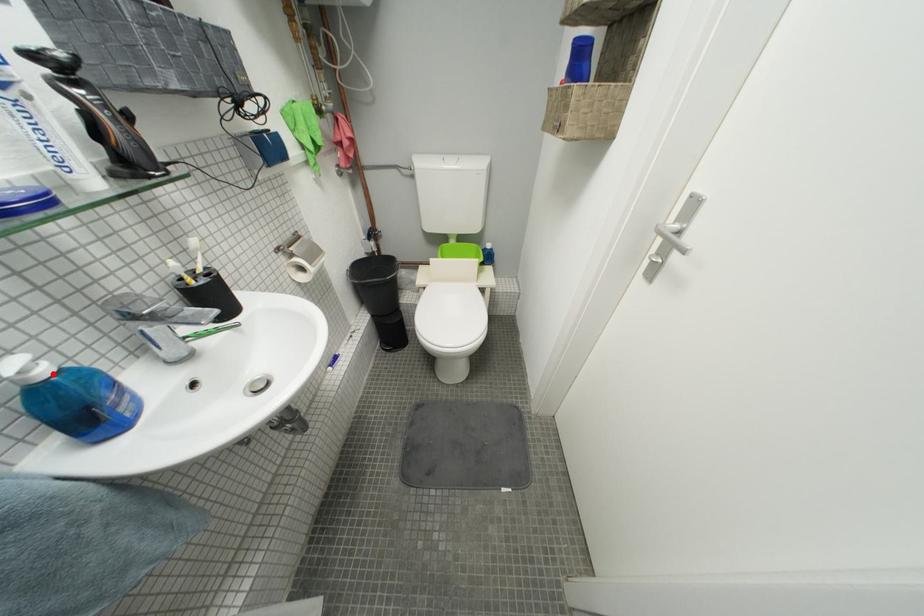
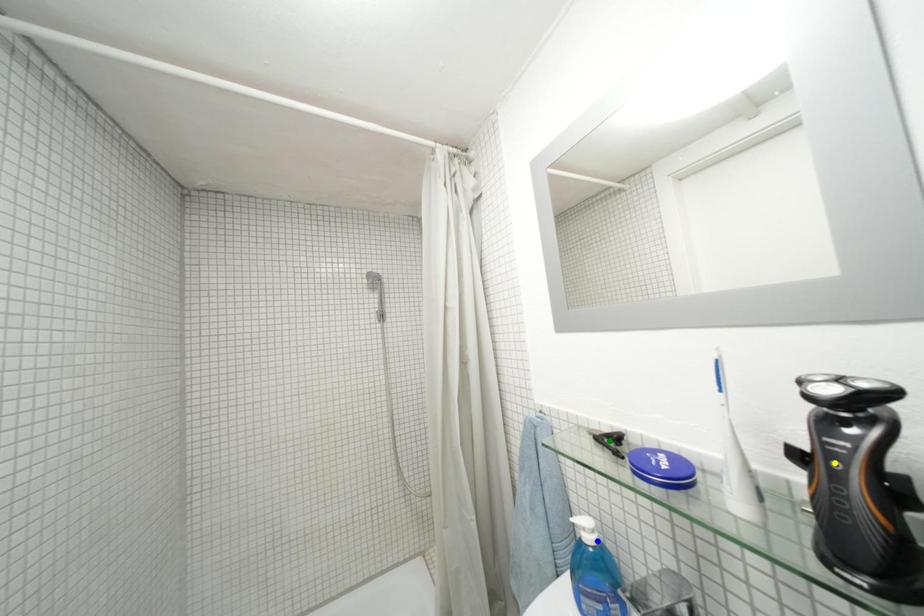
Question: I am providing you with two images of the same scene from different viewpoints. A red point is marked on the first image. You are given multiple points on the second image. Which point in image 2 represents the same 3d spot as the red point in image 1?

Choices:
 (A) yellow point
 (B) green point
 (C) blue point

Answer: (C)